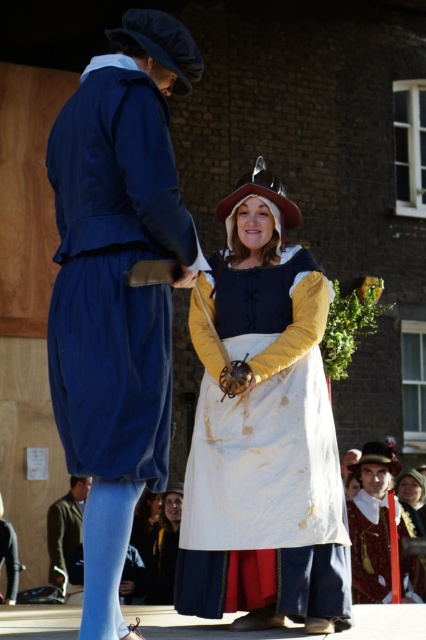
You are an observer standing in front of the brick building with wooden paneling. You notice the velvet blue robe at center and the person on the left holding a sword hilt. Based on their positions, which object is closer to the center of the image?

The velvet blue robe at center is located at point [117,285], which is closer to the center coordinates of [213,320] compared to the person on the left holding a sword hilt. Therefore, the velvet blue robe at center is closer to the center of the image.

What is the position of the white cotton apron at center in the image?

The white cotton apron at center is located at point (166, 548).